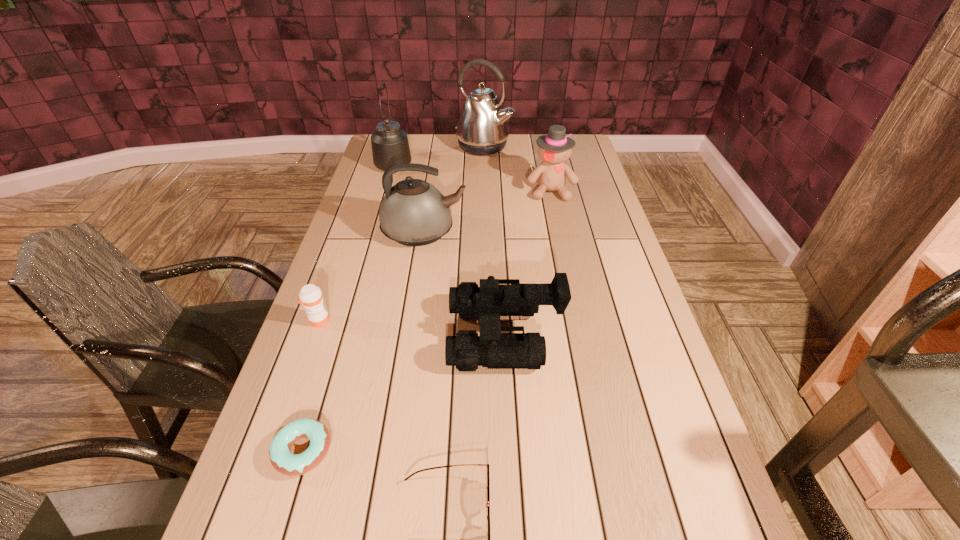
Locate an element on the screen. unoccupied area between the sixth tallest object and the rag_doll is located at coordinates (435, 256).

Find the location of a particular element. The height and width of the screenshot is (540, 960). empty space between the third shortest object and the rag_doll is located at coordinates pyautogui.click(x=435, y=256).

The width and height of the screenshot is (960, 540). In order to click on object that stands as the fourth closest to the sixth nearest object in this screenshot , I will do `click(495, 297)`.

Select which object appears as the third closest to the binoculars. Please provide its 2D coordinates. Your answer should be formatted as a tuple, i.e. [(x, y)], where the tuple contains the x and y coordinates of a point satisfying the conditions above.

[(285, 462)]

Locate an element on the screen. This screenshot has width=960, height=540. the closest kettle to the medicine is located at coordinates (413, 212).

Where is `kettle that is the third closest to the shortest object`? The image size is (960, 540). kettle that is the third closest to the shortest object is located at coordinates (482, 129).